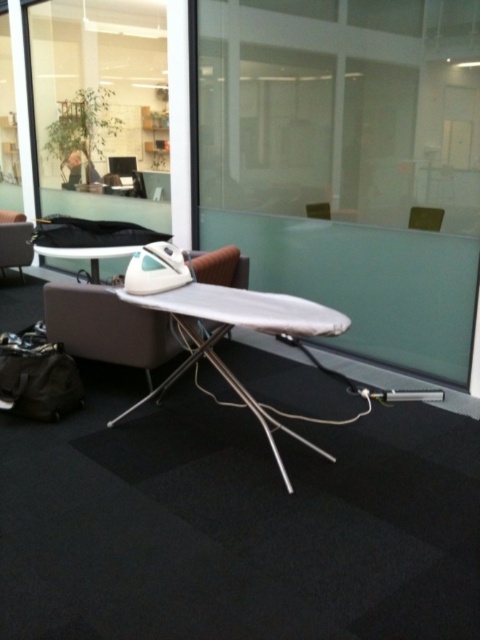
Question: Among these objects, which one is nearest to the camera?

Choices:
 (A) matte brown leather chair at left
 (B) white glossy ironing board at center
 (C) matte plastic chair at center

Answer: (B)

Question: Which point is closer to the camera?

Choices:
 (A) pos(310,209)
 (B) pos(61,246)

Answer: (B)

Question: Does white glossy ironing board at center come in front of matte brown leather chair at left?

Choices:
 (A) no
 (B) yes

Answer: (B)

Question: Among these points, which one is nearest to the camera?

Choices:
 (A) (315, 212)
 (B) (12, 259)
 (C) (200, 337)

Answer: (C)

Question: Does white glossy ironing board at center appear under matte plastic chair at center?

Choices:
 (A) yes
 (B) no

Answer: (A)

Question: Does white plastic ironing board at center appear on the right side of brown leather chair at center?

Choices:
 (A) no
 (B) yes

Answer: (A)